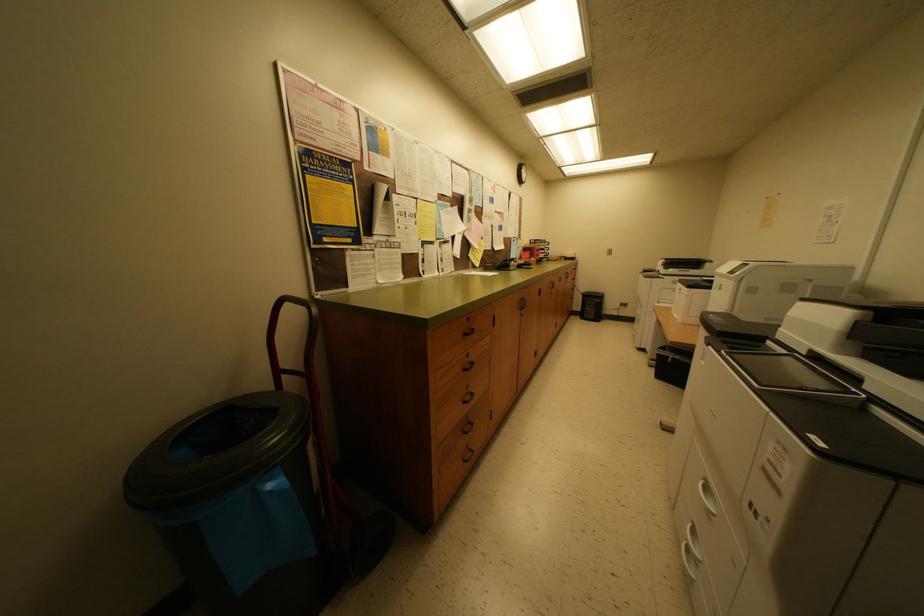
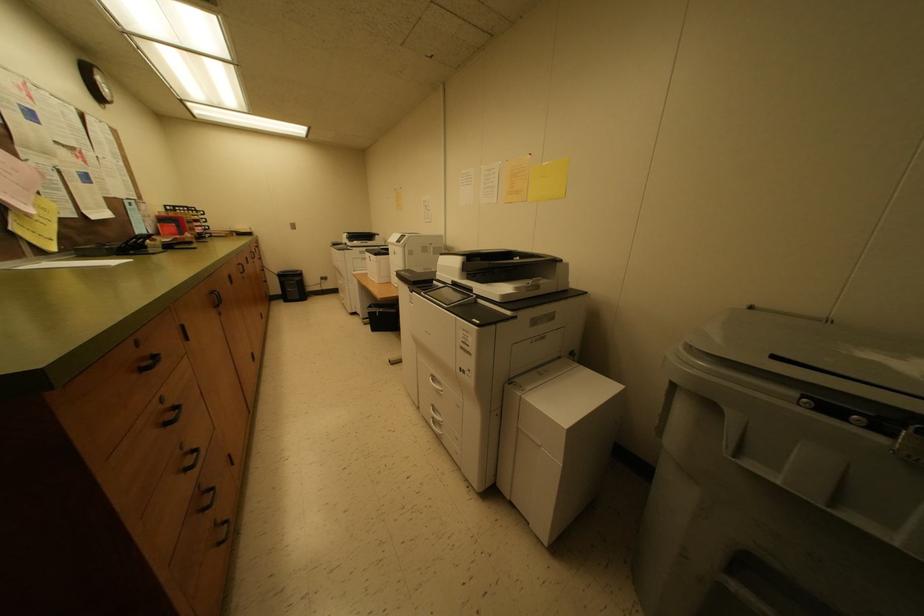
Question: Based on the continuous images, in which direction is the camera rotating? Reply with the corresponding letter.

Choices:
 (A) Left
 (B) Right
 (C) Up
 (D) Down

Answer: (B)